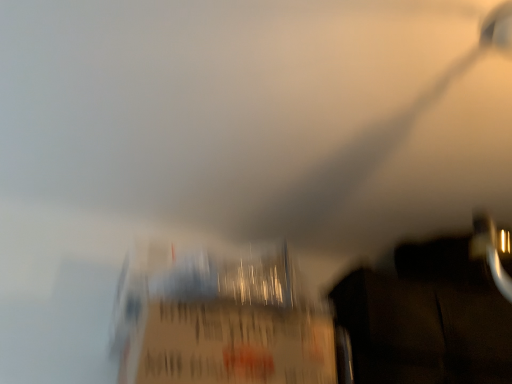
The height and width of the screenshot is (384, 512). What do you see at coordinates (433, 311) in the screenshot?
I see `dark matte wood drawer at lower right` at bounding box center [433, 311].

Image resolution: width=512 pixels, height=384 pixels. In order to click on dark matte wood drawer at lower right in this screenshot , I will do `click(433, 311)`.

In order to face dark matte wood drawer at lower right, should I rotate leftwards or rightwards?

A 25.343 degree turn to the right will do.

Describe the element at coordinates (219, 320) in the screenshot. I see `matte cardboard box at center` at that location.

Find the location of a particular element. The width and height of the screenshot is (512, 384). matte cardboard box at center is located at coordinates (219, 320).

Image resolution: width=512 pixels, height=384 pixels. Identify the location of dark matte wood drawer at lower right. (433, 311).

Which object is positioned more to the right, dark matte wood drawer at lower right or matte cardboard box at center?

dark matte wood drawer at lower right is more to the right.

Is dark matte wood drawer at lower right positioned behind matte cardboard box at center?

Yes, it is behind matte cardboard box at center.

Considering the points (389, 366) and (250, 356), which point is in front, point (389, 366) or point (250, 356)?

The point (250, 356) is more forward.

From the image's perspective, is dark matte wood drawer at lower right beneath matte cardboard box at center?

Indeed, from the image's perspective, dark matte wood drawer at lower right is shown beneath matte cardboard box at center.

From a real-world perspective, is dark matte wood drawer at lower right under matte cardboard box at center?

No, from a real-world perspective, dark matte wood drawer at lower right is not beneath matte cardboard box at center.

Considering the sizes of dark matte wood drawer at lower right and matte cardboard box at center in the image, is dark matte wood drawer at lower right wider or thinner than matte cardboard box at center?

In the image, dark matte wood drawer at lower right appears to be wider than matte cardboard box at center.

Considering the sizes of objects dark matte wood drawer at lower right and matte cardboard box at center in the image provided, who is taller, dark matte wood drawer at lower right or matte cardboard box at center?

dark matte wood drawer at lower right.

From the picture: Considering the sizes of objects dark matte wood drawer at lower right and matte cardboard box at center in the image provided, who is smaller, dark matte wood drawer at lower right or matte cardboard box at center?

Smaller between the two is matte cardboard box at center.

Would you say matte cardboard box at center is part of dark matte wood drawer at lower right's contents?

No.

Are dark matte wood drawer at lower right and matte cardboard box at center beside each other?

No, dark matte wood drawer at lower right is not touching matte cardboard box at center.

Is dark matte wood drawer at lower right facing towards matte cardboard box at center?

No, dark matte wood drawer at lower right is not facing towards matte cardboard box at center.

How many degrees apart are the facing directions of dark matte wood drawer at lower right and matte cardboard box at center?

They differ by 0.000717 degrees in their facing directions.

Measure the distance between dark matte wood drawer at lower right and matte cardboard box at center.

dark matte wood drawer at lower right is 11.47 inches away from matte cardboard box at center.

Locate an element on the screen. The image size is (512, 384). dark located behind the matte cardboard box at center is located at coordinates (433, 311).

Considering the relative positions of matte cardboard box at center and dark matte wood drawer at lower right in the image provided, is matte cardboard box at center to the right of dark matte wood drawer at lower right from the viewer's perspective?

Incorrect, matte cardboard box at center is not on the right side of dark matte wood drawer at lower right.

From the picture: Is the position of matte cardboard box at center more distant than that of dark matte wood drawer at lower right?

No, it is in front of dark matte wood drawer at lower right.

Which point is more forward, (228, 339) or (434, 304)?

The point (228, 339) is in front.

From the image's perspective, between matte cardboard box at center and dark matte wood drawer at lower right, who is located below?

dark matte wood drawer at lower right, from the image's perspective.

From a real-world perspective, which is physically above, matte cardboard box at center or dark matte wood drawer at lower right?

From a 3D spatial view, dark matte wood drawer at lower right is above.

Considering the sizes of matte cardboard box at center and dark matte wood drawer at lower right in the image, is matte cardboard box at center wider or thinner than dark matte wood drawer at lower right?

matte cardboard box at center is thinner than dark matte wood drawer at lower right.

Which of these two, matte cardboard box at center or dark matte wood drawer at lower right, stands taller?

Standing taller between the two is dark matte wood drawer at lower right.

Considering the sizes of objects matte cardboard box at center and dark matte wood drawer at lower right in the image provided, who is smaller, matte cardboard box at center or dark matte wood drawer at lower right?

matte cardboard box at center.

Is matte cardboard box at center outside of dark matte wood drawer at lower right?

matte cardboard box at center is positioned outside dark matte wood drawer at lower right.

Would you consider matte cardboard box at center to be distant from dark matte wood drawer at lower right?

No, matte cardboard box at center is not far away from dark matte wood drawer at lower right.

Is matte cardboard box at center turned away from dark matte wood drawer at lower right?

No, matte cardboard box at center is not facing away from dark matte wood drawer at lower right.

Consider the image. How many degrees apart are the facing directions of matte cardboard box at center and dark matte wood drawer at lower right?

They differ by 0.000717 degrees in their facing directions.

You are a GUI agent. You are given a task and a screenshot of the screen. Output one action in this format:
    pyautogui.click(x=<x>, y=<y>)
    Task: Click on the dark behind the matte cardboard box at center
    The width and height of the screenshot is (512, 384).
    Given the screenshot: What is the action you would take?
    pyautogui.click(x=433, y=311)

I want to click on cardboard box in front of the dark matte wood drawer at lower right, so click(219, 320).

At what (x,y) coordinates should I click in order to perform the action: click on dark below the matte cardboard box at center (from the image's perspective). Please return your answer as a coordinate pair (x, y). The image size is (512, 384). Looking at the image, I should click on (433, 311).